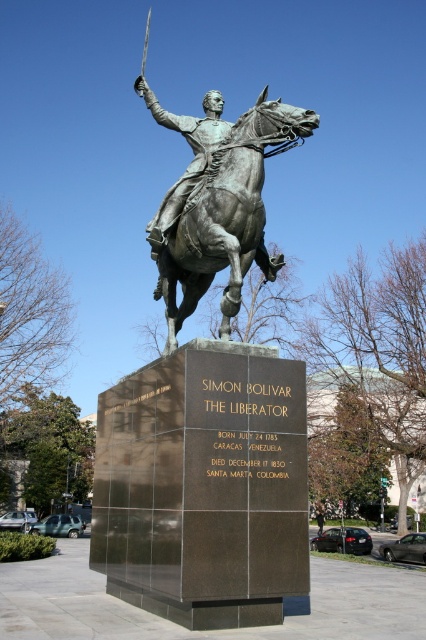
Image resolution: width=426 pixels, height=640 pixels. What do you see at coordinates (210, 422) in the screenshot? I see `bronze statue at center` at bounding box center [210, 422].

Can you confirm if bronze statue at center is taller than bronze/golden at center?

No.

Is point (144, 429) farther from viewer compared to point (224, 163)?

That is False.

Identify the location of bronze statue at center. pyautogui.click(x=210, y=422).